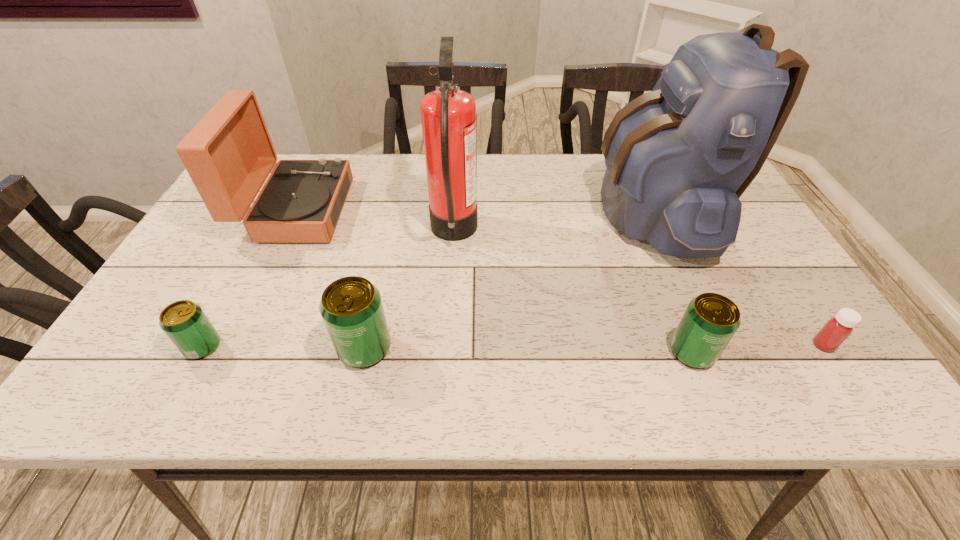
Identify the location of the shortest beer can. (184, 322).

Locate an element on the screen. Image resolution: width=960 pixels, height=540 pixels. the tallest beer can is located at coordinates (351, 307).

Where is `the fourth tallest object`? This screenshot has height=540, width=960. the fourth tallest object is located at coordinates (351, 307).

Image resolution: width=960 pixels, height=540 pixels. Identify the location of the rightmost beer can. (710, 320).

I want to click on the second shortest beer can, so click(x=710, y=320).

Locate an element on the screen. phonograph record is located at coordinates (229, 154).

Identify the location of fire extinguisher. This screenshot has height=540, width=960. (448, 115).

I want to click on backpack, so click(678, 158).

Identify the location of medicine. (837, 329).

What are the coordinates of `vacant space located on the right of the shortest beer can` in the screenshot? It's located at (391, 347).